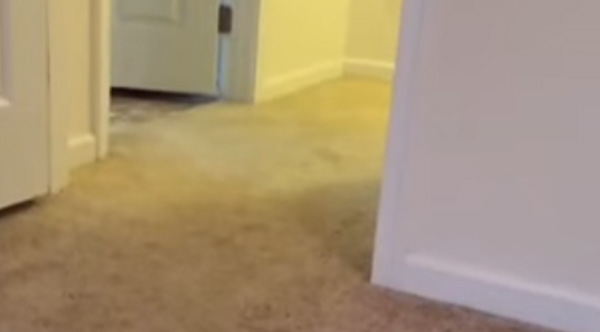
This screenshot has height=332, width=600. Find the location of `door hinge`. door hinge is located at coordinates (224, 22).